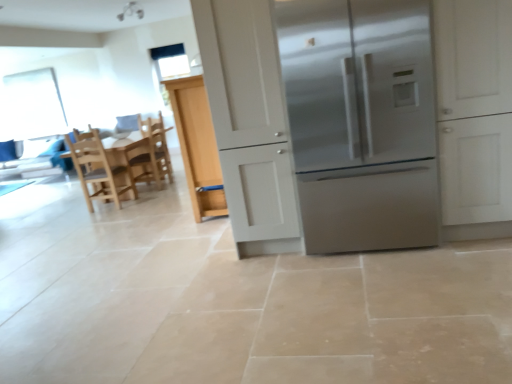
Question: Is the position of wooden chair at center, which is the first chair from back to front, less distant than that of transparent plastic window screen at upper left, which appears as the 1th window screen when viewed from the left?

Choices:
 (A) yes
 (B) no

Answer: (A)

Question: Is wooden chair at center, which is the first chair from back to front, wider than transparent plastic window screen at upper left, the second window screen positioned from the front?

Choices:
 (A) yes
 (B) no

Answer: (A)

Question: Can you confirm if wooden chair at center, which is the first chair from back to front, is shorter than transparent plastic window screen at upper left, arranged as the 1th window screen when viewed from the back?

Choices:
 (A) no
 (B) yes

Answer: (B)

Question: Would you consider wooden chair at center, which is the second chair in front-to-back order, to be distant from transparent plastic window screen at upper left, acting as the second window screen starting from the right?

Choices:
 (A) no
 (B) yes

Answer: (B)

Question: From the image's perspective, is wooden chair at center, which is the first chair from back to front, located above transparent plastic window screen at upper left, acting as the second window screen starting from the right?

Choices:
 (A) no
 (B) yes

Answer: (A)

Question: Can you confirm if wooden chair at center, which is the first chair from back to front, is positioned to the left of transparent plastic window screen at upper left, which appears as the 1th window screen when viewed from the left?

Choices:
 (A) no
 (B) yes

Answer: (A)

Question: Would you consider light wood chair at left, which is the first chair in front-to-back order, to be distant from transparent plastic window screen at upper left, arranged as the 1th window screen when viewed from the back?

Choices:
 (A) no
 (B) yes

Answer: (B)

Question: Is light wood chair at left, which is the first chair in front-to-back order, at the right side of transparent plastic window screen at upper left, which appears as the 1th window screen when viewed from the left?

Choices:
 (A) yes
 (B) no

Answer: (A)

Question: Does light wood chair at left, the 2th chair positioned from the back, have a larger size compared to transparent plastic window screen at upper left, the second window screen positioned from the front?

Choices:
 (A) yes
 (B) no

Answer: (A)

Question: From the image's perspective, is light wood chair at left, which is the first chair in front-to-back order, located above transparent plastic window screen at upper left, arranged as the 1th window screen when viewed from the back?

Choices:
 (A) no
 (B) yes

Answer: (A)

Question: Does light wood chair at left, the 2th chair positioned from the back, touch transparent plastic window screen at upper left, the second window screen positioned from the front?

Choices:
 (A) yes
 (B) no

Answer: (B)

Question: Can you confirm if light wood chair at left, which is the first chair in front-to-back order, is shorter than transparent plastic window screen at upper left, the second window screen positioned from the front?

Choices:
 (A) yes
 (B) no

Answer: (A)

Question: Is light wood chair at left, which is the first chair in front-to-back order, at the left side of clear glass window screen at upper center, which is counted as the second window screen, starting from the back?

Choices:
 (A) no
 (B) yes

Answer: (B)